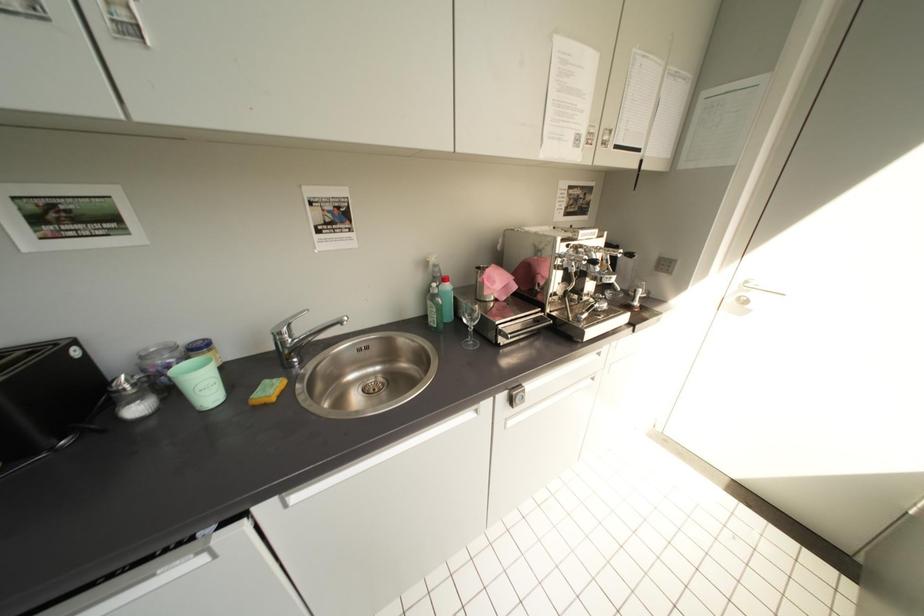
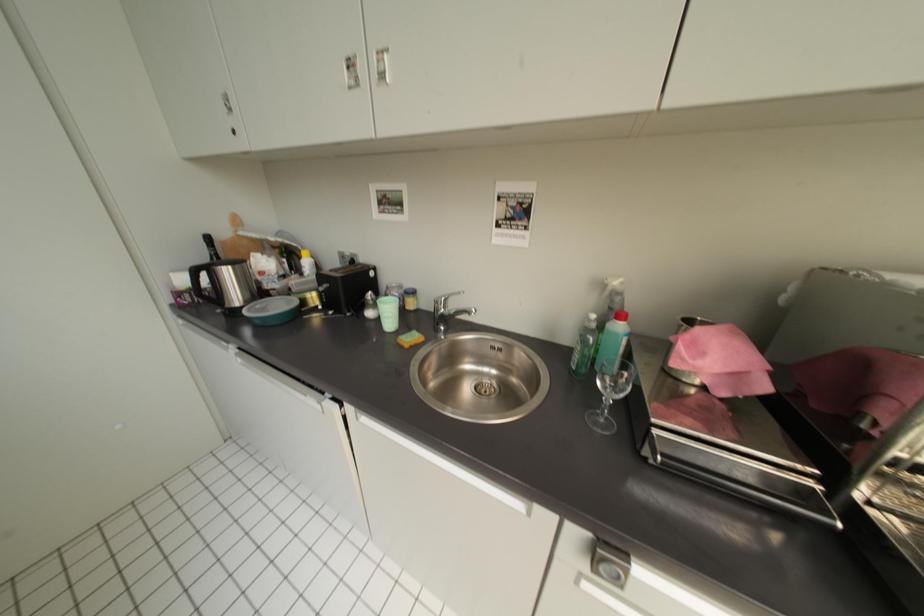
Question: How did the camera likely rotate?

Choices:
 (A) Left
 (B) Right
 (C) Up
 (D) Down

Answer: (A)